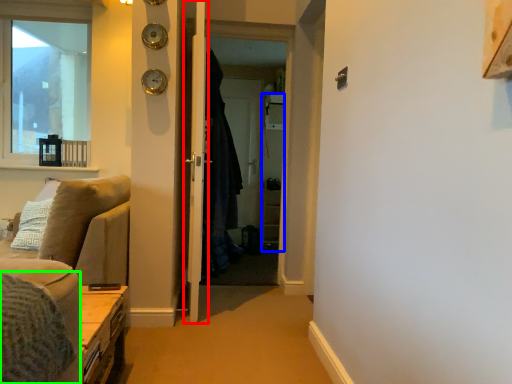
Question: Which object is positioned farthest from door (highlighted by a red box)? Select from cabinetry (highlighted by a blue box) and bedding (highlighted by a green box).

Choices:
 (A) cabinetry
 (B) bedding

Answer: (A)